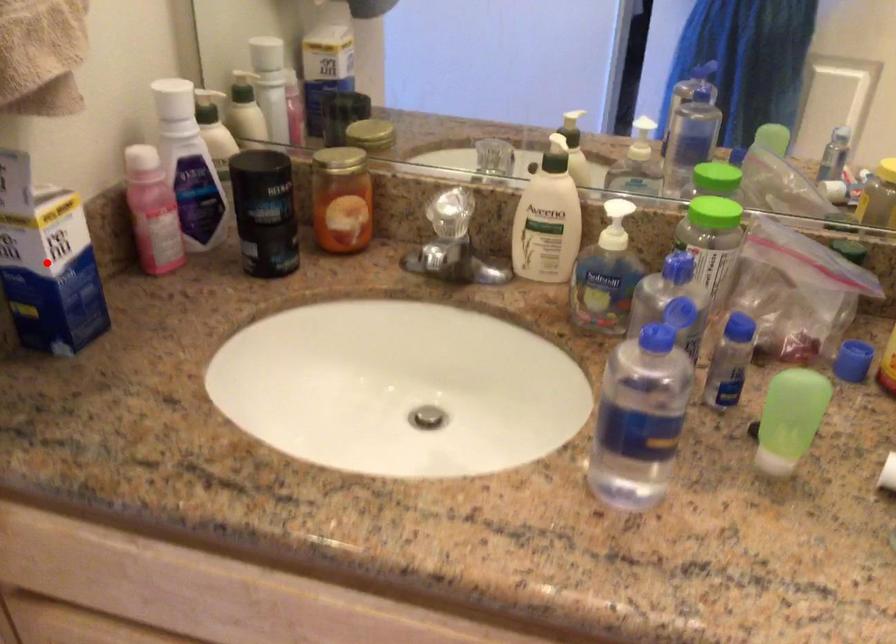
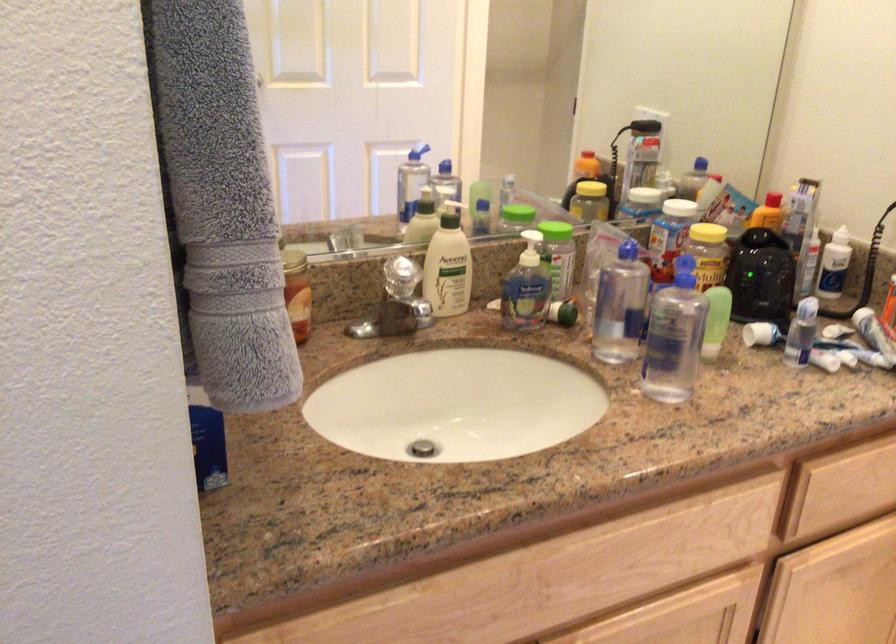
Question: I am providing you with two images of the same scene from different viewpoints. A red point is marked on the first image. Is the red point's position out of view in image 2?

Choices:
 (A) Yes
 (B) No

Answer: (A)